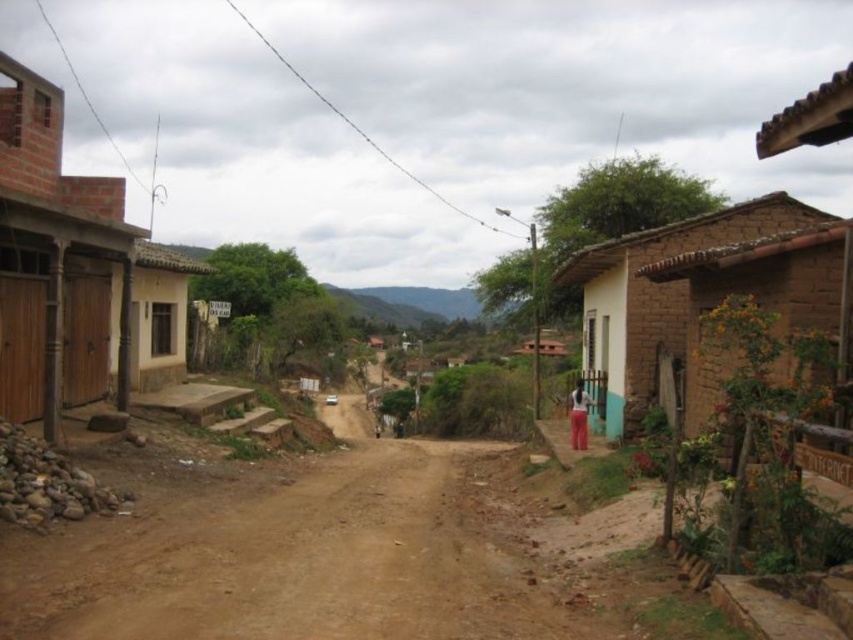
Does brown brick hut at left lie in front of brown clay hut at right?

Yes, brown brick hut at left is closer to the viewer.

From the picture: Can you confirm if brown brick hut at left is thinner than brown clay hut at right?

Correct, brown brick hut at left's width is less than brown clay hut at right's.

Locate an element on the screen. The height and width of the screenshot is (640, 853). brown brick hut at left is located at coordinates (73, 272).

The width and height of the screenshot is (853, 640). Find the location of `brown brick hut at left`. brown brick hut at left is located at coordinates (73, 272).